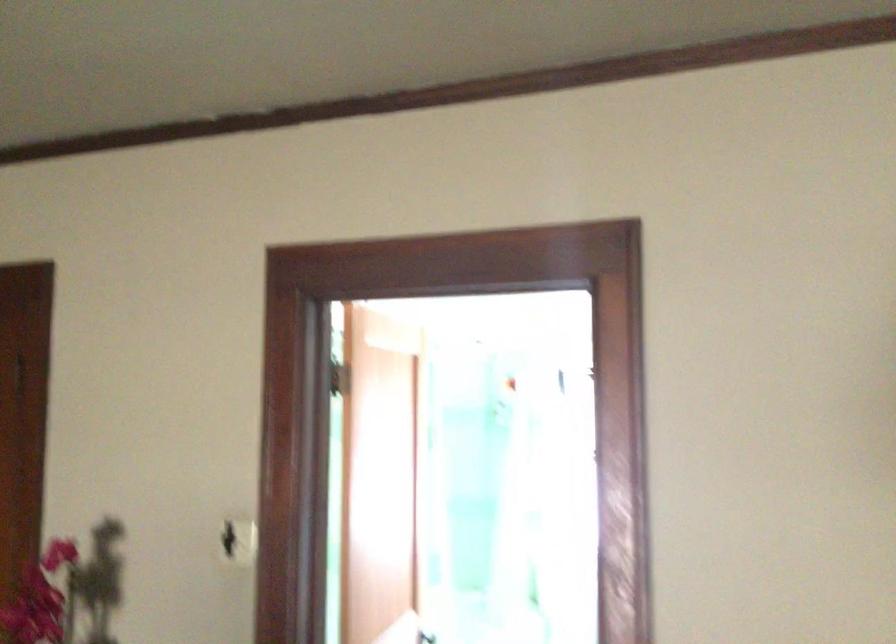
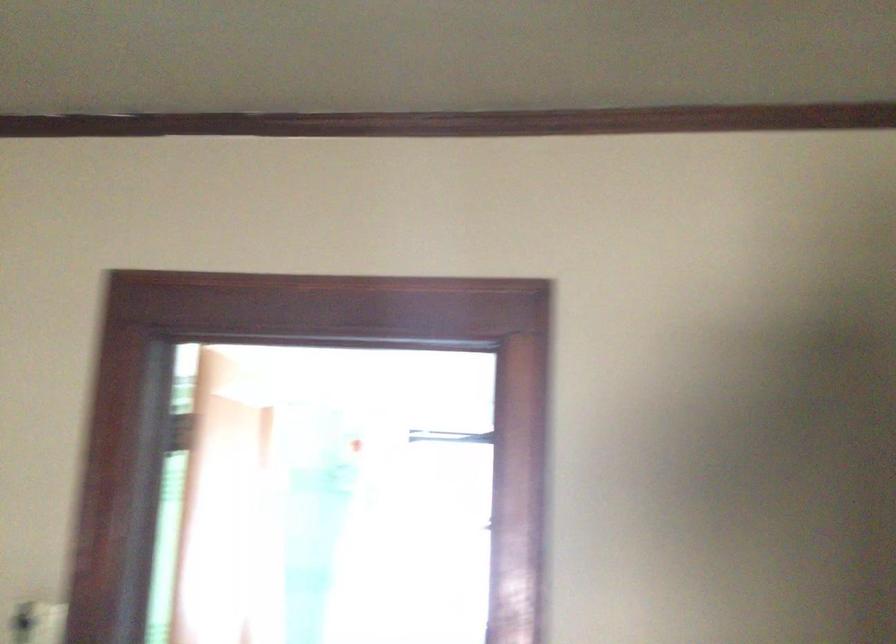
In a continuous first-person perspective shot, in which direction is the camera moving?

The cameraman walked toward left, forward.